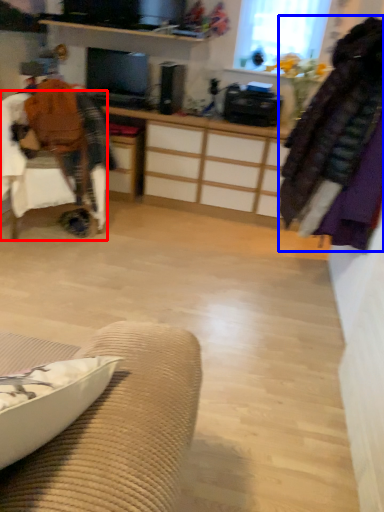
Question: Which of the following is the farthest to the observer, chair (highlighted by a red box) or clothing (highlighted by a blue box)?

Choices:
 (A) chair
 (B) clothing

Answer: (A)